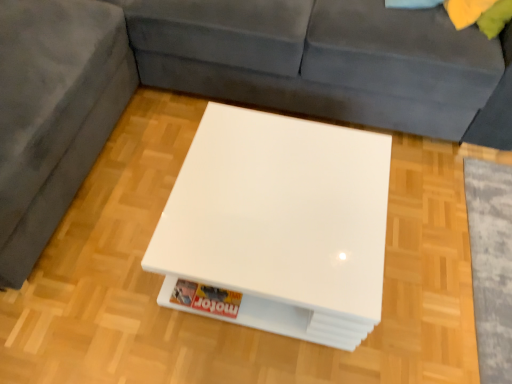
Where is `free spot to the left of white glossy table at center`? free spot to the left of white glossy table at center is located at coordinates (108, 247).